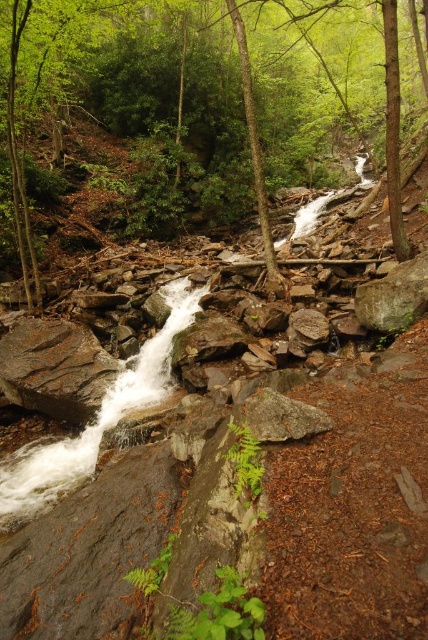
You are standing at the base of the waterfall in the forest scene. You notice two points marked in the image. The first point is at coordinates point (53,161) and the second is at point (58,340). Which point is closer to you as you face the waterfall?

Point (58,340) is closer to you because it is in front of point (53,161).

You are a hiker who wants to cross the forest to reach the waterfall. You have a 10 meter long rope. You see the green leafy tree at center and the rusty metallic rock at lower left. Can you use the rope to bridge the gap between them?

The distance between the green leafy tree at center and the rusty metallic rock at lower left is 15.86 meters. Since the rope is only 10 meters long, it is not long enough to bridge the gap between them.

You are a hiker who wants to take a photo of the green leafy tree at center and the rusty metallic rock at lower left. Which object should you focus on first if you want to capture both in one frame without moving your camera?

You should focus on the green leafy tree at center first because it is larger in size compared to the rusty metallic rock at lower left, making it easier to frame properly.